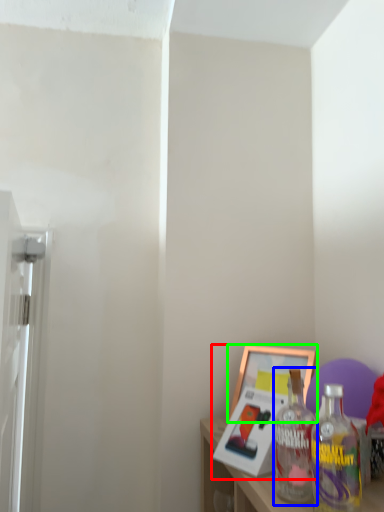
Question: Which object is the closest to the picture frame (highlighted by a red box)? Choose among these: bottle (highlighted by a blue box) or picture frame (highlighted by a green box).

Choices:
 (A) bottle
 (B) picture frame

Answer: (B)